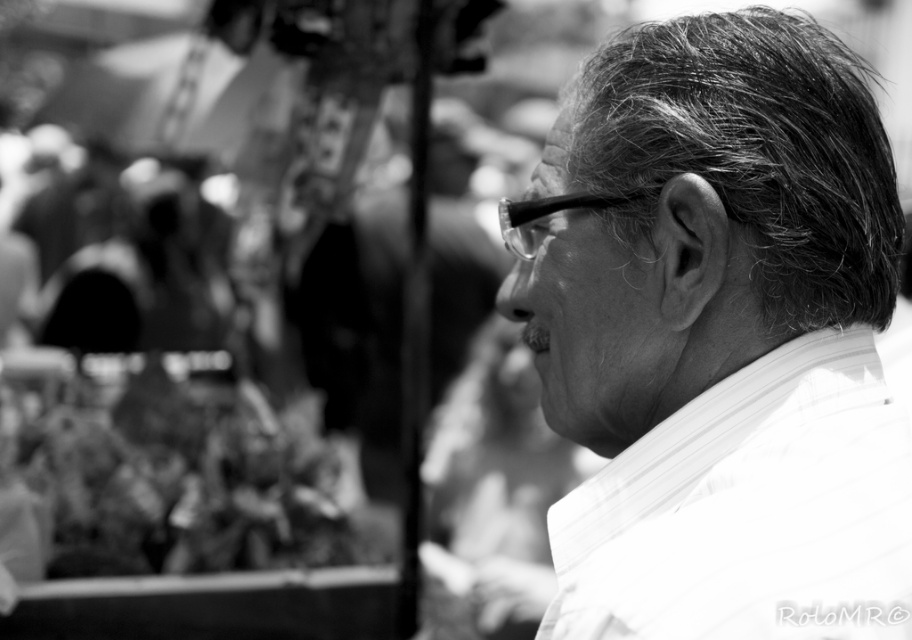
Can you confirm if white striped dress shirt at right is smaller than gray textured hair at upper right?

Correct, white striped dress shirt at right occupies less space than gray textured hair at upper right.

In the scene shown: Can you confirm if white striped dress shirt at right is positioned above gray textured hair at upper right?

No, white striped dress shirt at right is not above gray textured hair at upper right.

At what (x,y) coordinates should I click in order to perform the action: click on white striped dress shirt at right. Please return your answer as a coordinate pair (x, y). The image size is (912, 640). Looking at the image, I should click on (749, 512).

Who is higher up, white textured shirt at right or white striped dress shirt at right?

white textured shirt at right

Based on the photo, is white textured shirt at right positioned at the back of white striped dress shirt at right?

Yes, it is behind white striped dress shirt at right.

Measure the distance between white textured shirt at right and camera.

white textured shirt at right and camera are 31.17 inches apart from each other.

The image size is (912, 640). Identify the location of white textured shirt at right. (721, 339).

From the picture: Can you confirm if white textured shirt at right is positioned to the right of gray textured hair at upper right?

In fact, white textured shirt at right is to the left of gray textured hair at upper right.

You are a GUI agent. You are given a task and a screenshot of the screen. Output one action in this format:
    pyautogui.click(x=<x>, y=<y>)
    Task: Click on the white textured shirt at right
    This screenshot has height=640, width=912.
    Given the screenshot: What is the action you would take?
    pyautogui.click(x=721, y=339)

Who is more forward, (809,212) or (576,156)?

Point (809,212) is more forward.

Locate an element on the screen. white textured shirt at right is located at coordinates (721, 339).